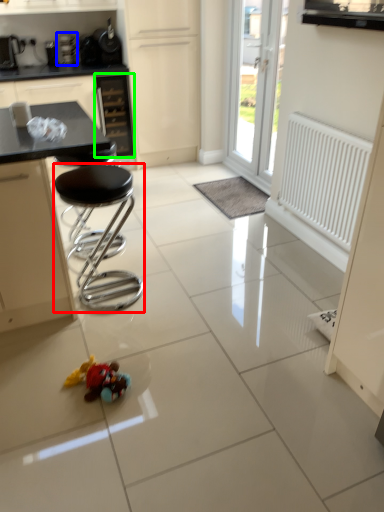
Question: Based on their relative distances, which object is farther from stool (highlighted by a red box)? Choose from appliance (highlighted by a blue box) and drawer (highlighted by a green box).

Choices:
 (A) appliance
 (B) drawer

Answer: (A)